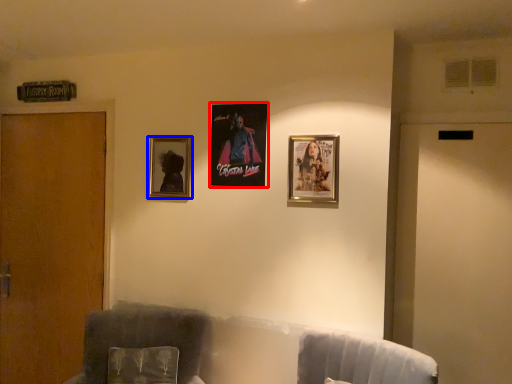
Question: Which point is closer to the camera, picture frame (highlighted by a red box) or picture frame (highlighted by a blue box)?

Choices:
 (A) picture frame
 (B) picture frame

Answer: (A)